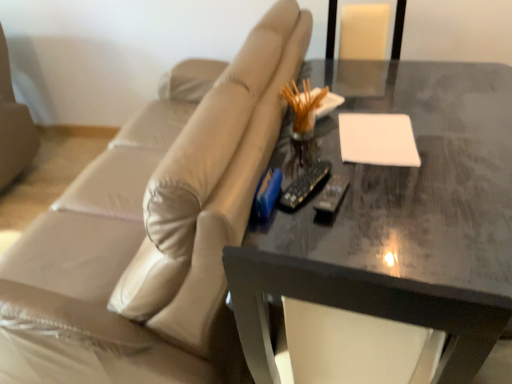
Where is `vacant space that is to the left of white matte notepad at upper right`? vacant space that is to the left of white matte notepad at upper right is located at coordinates (313, 150).